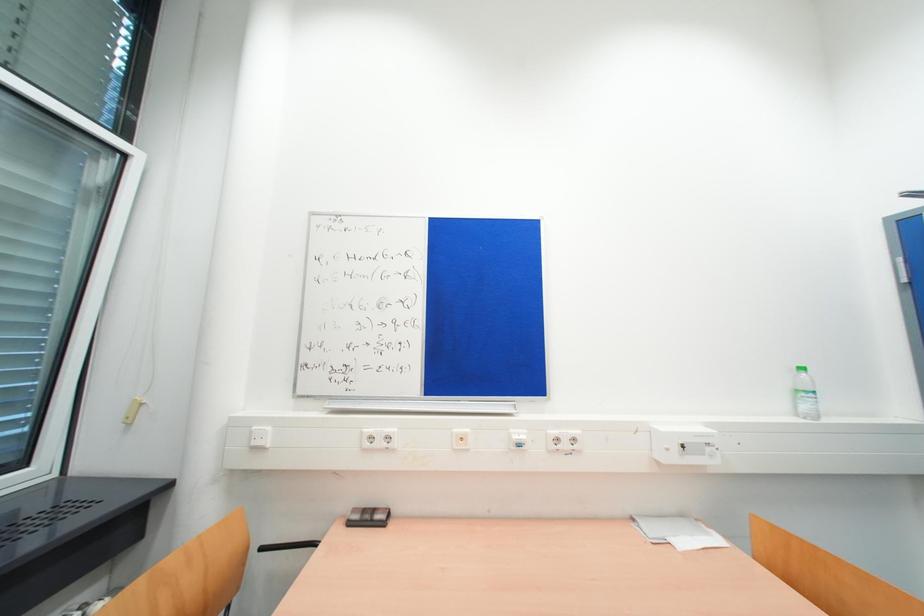
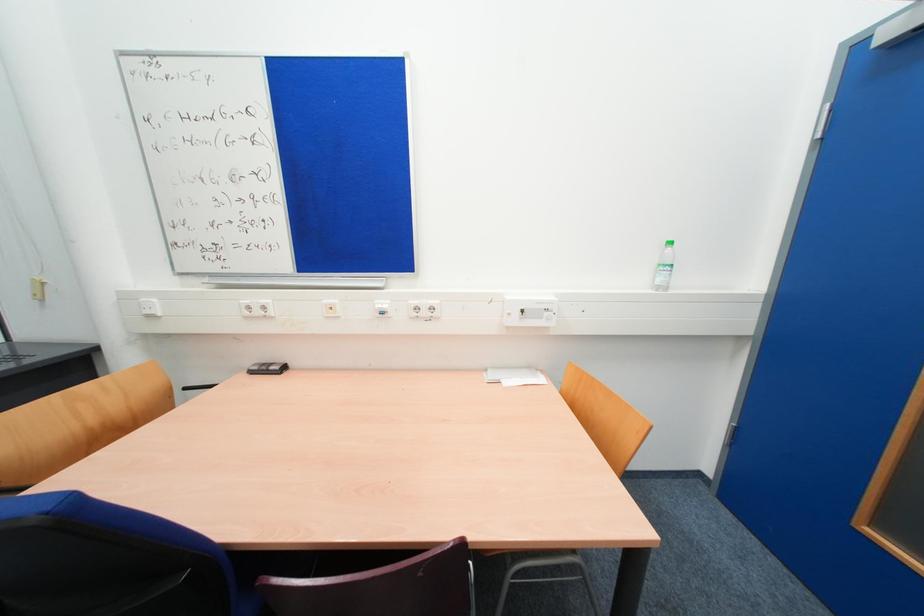
Question: The images are taken continuously from a first-person perspective. In which direction are you moving?

Choices:
 (A) Left
 (B) Right
 (C) Forward
 (D) Backward

Answer: (B)